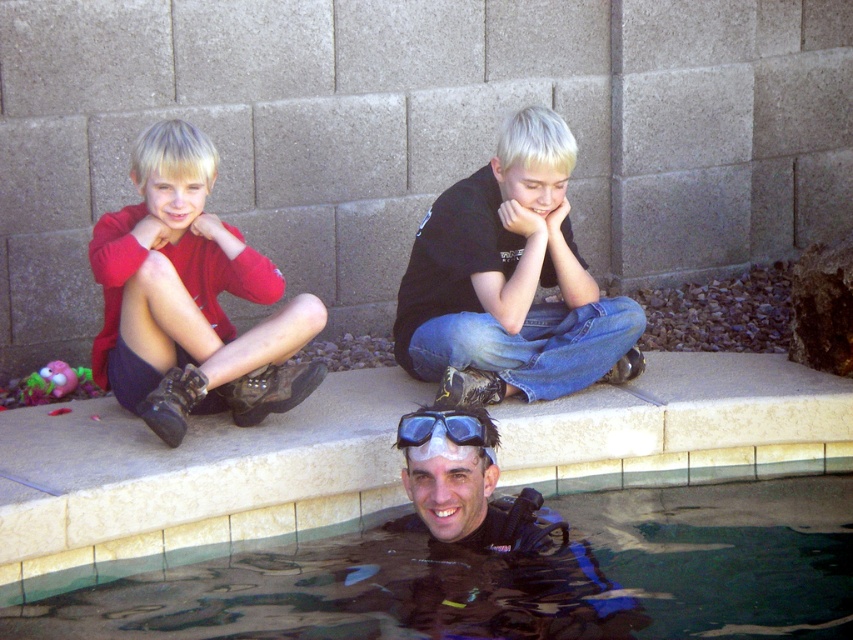
Question: Among these points, which one is farthest from the camera?

Choices:
 (A) (152, 460)
 (B) (538, 380)
 (C) (466, 435)
 (D) (196, 384)

Answer: (B)

Question: Which point is closer to the camera?

Choices:
 (A) clear glass water at lower center
 (B) blue matte goggles at lower center
 (C) black matte shirt at center

Answer: (A)

Question: Is beige concrete ledge at upper center wider than black matte shirt at center?

Choices:
 (A) no
 (B) yes

Answer: (B)

Question: Does beige concrete ledge at upper center appear on the right side of blue matte goggles at lower center?

Choices:
 (A) yes
 (B) no

Answer: (B)

Question: Does matte red hoodie at left appear on the left side of blue matte goggles at lower center?

Choices:
 (A) no
 (B) yes

Answer: (B)

Question: Which object is positioned farthest from the beige concrete ledge at upper center?

Choices:
 (A) black matte shirt at center
 (B) matte red hoodie at left
 (C) blue matte goggles at lower center

Answer: (C)